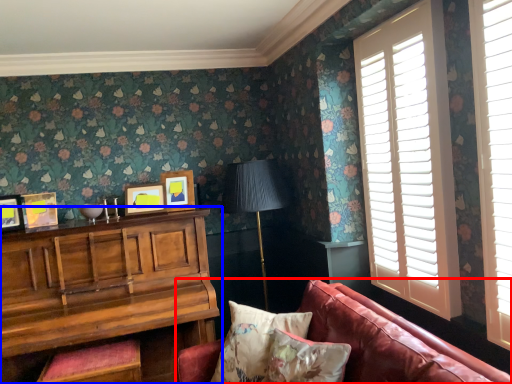
Question: Which point is further to the camera, studio couch (highlighted by a red box) or table (highlighted by a blue box)?

Choices:
 (A) studio couch
 (B) table

Answer: (B)